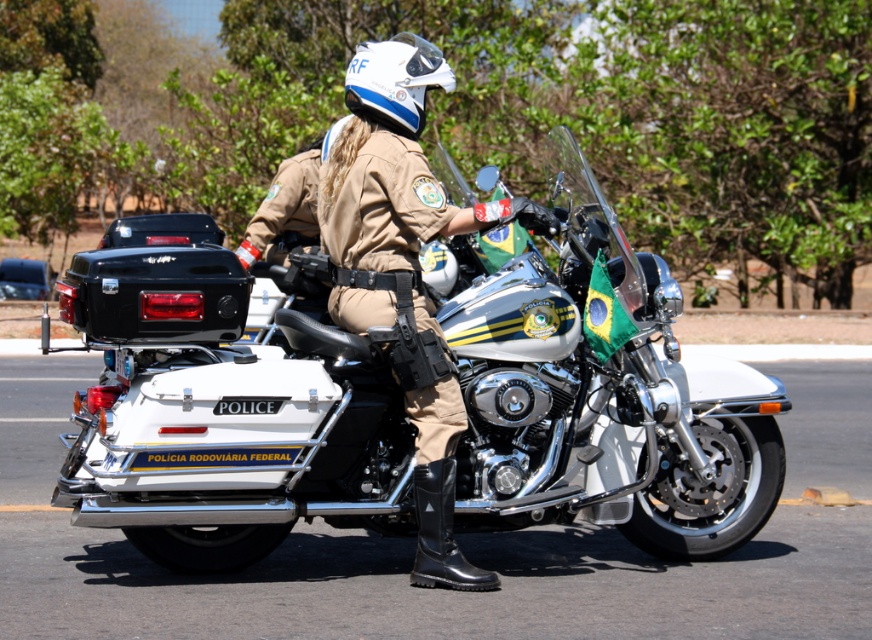
Is white metallic motorcycle at center to the right of white matte helmet at upper center from the viewer's perspective?

Indeed, white metallic motorcycle at center is positioned on the right side of white matte helmet at upper center.

The width and height of the screenshot is (872, 640). What are the coordinates of `white metallic motorcycle at center` in the screenshot? It's located at pyautogui.click(x=603, y=401).

Which is in front, point (648, 429) or point (392, 74)?

Point (392, 74) is in front.

At what (x,y) coordinates should I click in order to perform the action: click on white metallic motorcycle at center. Please return your answer as a coordinate pair (x, y). The width and height of the screenshot is (872, 640). Looking at the image, I should click on (603, 401).

Which of these two, brown leather jacket at center or white matte helmet at upper center, stands shorter?

brown leather jacket at center is shorter.

Is point (433, 458) more distant than point (373, 93)?

No, (433, 458) is in front of (373, 93).

Is point (407, 115) more distant than point (387, 58)?

Yes, point (407, 115) is behind point (387, 58).

Where is `brown leather jacket at center`? This screenshot has width=872, height=640. brown leather jacket at center is located at coordinates 405,268.

Is white metallic motorcycle at center above brown leather jacket at center?

Actually, white metallic motorcycle at center is below brown leather jacket at center.

Is white metallic motorcycle at center positioned behind brown leather jacket at center?

Yes, it is.

What are the coordinates of `white metallic motorcycle at center` in the screenshot? It's located at (603, 401).